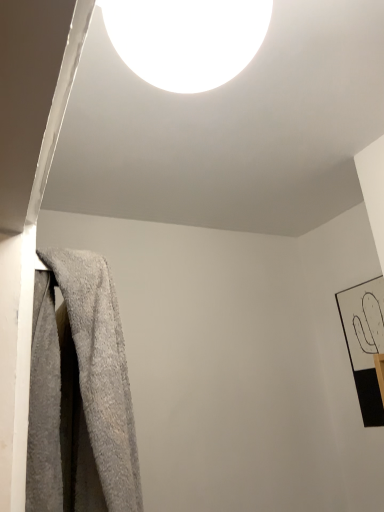
Describe the element at coordinates (80, 393) in the screenshot. Image resolution: width=384 pixels, height=512 pixels. I see `gray fluffy towel at left` at that location.

At what (x,y) coordinates should I click in order to perform the action: click on black matte picture frame at right. Please return your answer as a coordinate pair (x, y). Image resolution: width=384 pixels, height=512 pixels. Looking at the image, I should click on (364, 342).

At what (x,y) coordinates should I click in order to perform the action: click on white glossy light fixture at upper center. Please return your answer as a coordinate pair (x, y). Looking at the image, I should click on (186, 39).

Is black matte picture frame at right positioned before gray fluffy towel at left?

That is False.

Consider the image. What's the angular difference between black matte picture frame at right and gray fluffy towel at left's facing directions?

They differ by 178 degrees in their facing directions.

Considering the positions of objects black matte picture frame at right and gray fluffy towel at left in the image provided, who is more to the left, black matte picture frame at right or gray fluffy towel at left?

Positioned to the left is gray fluffy towel at left.

From the image's perspective, is black matte picture frame at right located above gray fluffy towel at left?

No.

From the image's perspective, which object appears higher, gray fluffy towel at left or black matte picture frame at right?

From the image's view, gray fluffy towel at left is above.

Does point (122, 364) come closer to viewer compared to point (373, 296)?

Yes, point (122, 364) is in front of point (373, 296).

Based on their sizes in the image, would you say gray fluffy towel at left is bigger or smaller than black matte picture frame at right?

Considering their sizes, gray fluffy towel at left takes up more space than black matte picture frame at right.

Can you tell me how much gray fluffy towel at left and black matte picture frame at right differ in facing direction?

178 degrees.

Between point (52, 288) and point (107, 18), which one is positioned behind?

The point (52, 288) is farther.

Which object is closer to the camera taking this photo, gray fluffy towel at left or white glossy light fixture at upper center?

white glossy light fixture at upper center is in front.

From a real-world perspective, is gray fluffy towel at left on top of white glossy light fixture at upper center?

No, from a real-world perspective, gray fluffy towel at left is not above white glossy light fixture at upper center.

Which of these two, white glossy light fixture at upper center or gray fluffy towel at left, is smaller?

Smaller between the two is white glossy light fixture at upper center.

Which is farther from the camera, (161, 37) or (39, 499)?

The point (39, 499) is behind.

From the image's perspective, which one is positioned higher, white glossy light fixture at upper center or gray fluffy towel at left?

white glossy light fixture at upper center.

Could you tell me if white glossy light fixture at upper center is facing gray fluffy towel at left?

No, white glossy light fixture at upper center is not oriented towards gray fluffy towel at left.

In the scene shown: Which object is thinner, white glossy light fixture at upper center or black matte picture frame at right?

Thinner between the two is black matte picture frame at right.

Does white glossy light fixture at upper center touch black matte picture frame at right?

They are not placed beside each other.

From a real-world perspective, is white glossy light fixture at upper center beneath black matte picture frame at right?

No, from a real-world perspective, white glossy light fixture at upper center is not below black matte picture frame at right.

Which is correct: white glossy light fixture at upper center is inside black matte picture frame at right, or outside of it?

The correct answer is: outside.

Is black matte picture frame at right to the left or to the right of white glossy light fixture at upper center in the image?

From the image, it's evident that black matte picture frame at right is to the right of white glossy light fixture at upper center.

Based on the photo, are black matte picture frame at right and white glossy light fixture at upper center located far from each other?

Indeed, black matte picture frame at right is not near white glossy light fixture at upper center.

Is black matte picture frame at right smaller than white glossy light fixture at upper center?

Actually, black matte picture frame at right might be larger than white glossy light fixture at upper center.

Which object is closer to the camera, black matte picture frame at right or white glossy light fixture at upper center?

white glossy light fixture at upper center is closer to the camera.

The image size is (384, 512). In order to click on picture frame below the gray fluffy towel at left (from the image's perspective) in this screenshot , I will do `click(364, 342)`.

Find the location of a particular element. towel below the black matte picture frame at right (from a real-world perspective) is located at coordinates (80, 393).

Estimate the real-world distances between objects in this image. Which object is further from black matte picture frame at right, gray fluffy towel at left or white glossy light fixture at upper center?

white glossy light fixture at upper center.

Which object lies further to the anchor point gray fluffy towel at left, white glossy light fixture at upper center or black matte picture frame at right?

black matte picture frame at right.

When comparing their distances from gray fluffy towel at left, does black matte picture frame at right or white glossy light fixture at upper center seem further?

Among the two, black matte picture frame at right is located further to gray fluffy towel at left.

Which object lies further to the anchor point black matte picture frame at right, white glossy light fixture at upper center or gray fluffy towel at left?

white glossy light fixture at upper center.

Which object lies further to the anchor point white glossy light fixture at upper center, black matte picture frame at right or gray fluffy towel at left?

Based on the image, black matte picture frame at right appears to be further to white glossy light fixture at upper center.

Considering their positions, is gray fluffy towel at left positioned further to white glossy light fixture at upper center than black matte picture frame at right?

Based on the image, black matte picture frame at right appears to be further to white glossy light fixture at upper center.

Locate an element on the screen. towel between white glossy light fixture at upper center and black matte picture frame at right in the front-back direction is located at coordinates (80, 393).